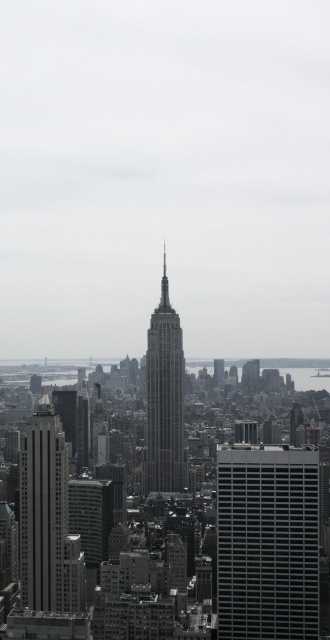
Question: Which of the following is the closest to the observer?

Choices:
 (A) (279, 531)
 (B) (146, 490)

Answer: (B)

Question: Can you confirm if matte silver skyscraper at center-left is positioned above gray glass skyscraper at center?

Choices:
 (A) yes
 (B) no

Answer: (B)

Question: Among these points, which one is nearest to the camera?

Choices:
 (A) (151, 333)
 (B) (266, 529)

Answer: (A)

Question: Which point is closer to the camera?

Choices:
 (A) gray glass skyscraper at center
 (B) matte silver skyscraper at center-left

Answer: (A)

Question: Is matte silver skyscraper at center-left above gray glass skyscraper at center?

Choices:
 (A) no
 (B) yes

Answer: (A)

Question: In this image, where is matte black building at center located relative to matte silver skyscraper at center-left?

Choices:
 (A) below
 (B) above

Answer: (A)